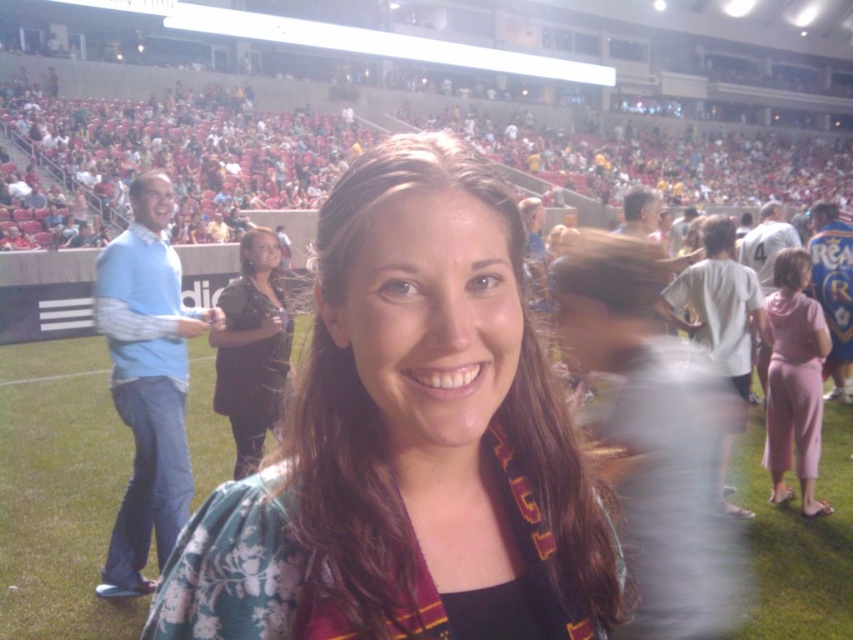
You are a photographer trying to capture a clear shot of the floral fabric shirt at center and the matte red seats at upper center. Which object will appear larger in your photo?

The floral fabric shirt at center will appear larger in the photo because it is closer to the viewer than the matte red seats at upper center.

From the picture: You are standing at the camera position and want to reach the point marked at coordinates (167,292). If your walking speed is 1.2 meters per second, how long will it take you to reach that point?

The point marked at coordinates (167,292) is 3.30 meters away from the camera. At a walking speed of 1.2 meters per second, it would take approximately 2.75 seconds to reach that point.

You are a photographer trying to capture a candid shot of both the floral fabric shirt at center and the black satin dress at center. Given their sizes, which one should you zoom in on more to ensure both fit in the frame?

Since the floral fabric shirt at center is wider than the black satin dress at center, you should zoom out slightly to accommodate the wider shirt while still keeping the dress in frame.